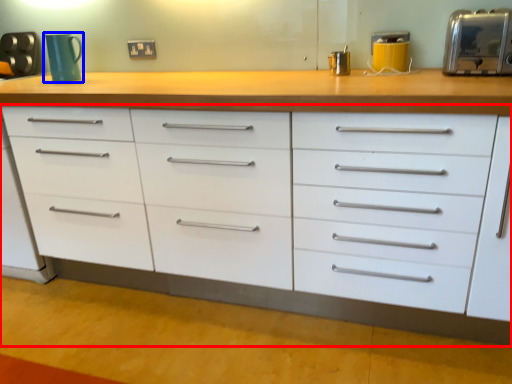
Question: Which point is closer to the camera, chest of drawers (highlighted by a red box) or mug (highlighted by a blue box)?

Choices:
 (A) chest of drawers
 (B) mug

Answer: (A)